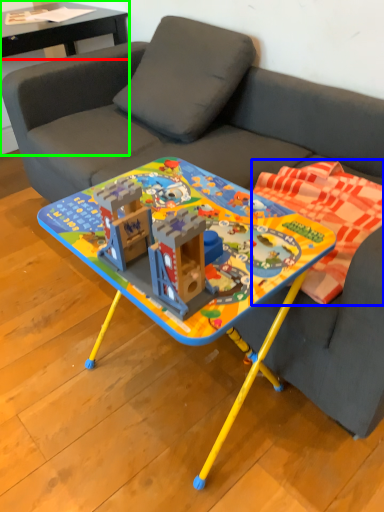
Question: Considering the real-world distances, which object is farthest from table (highlighted by a red box)? blanket (highlighted by a blue box) or side table (highlighted by a green box)?

Choices:
 (A) blanket
 (B) side table

Answer: (A)